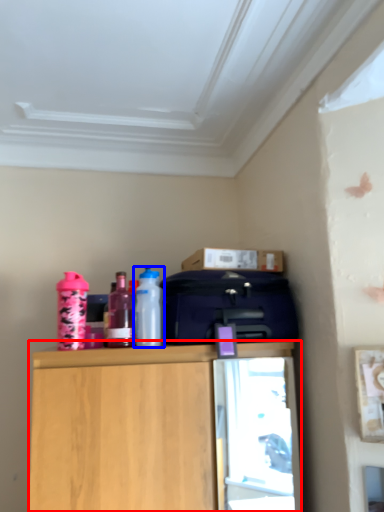
Question: Which object appears farthest to the camera in this image, cabinetry (highlighted by a red box) or bottle (highlighted by a blue box)?

Choices:
 (A) cabinetry
 (B) bottle

Answer: (B)